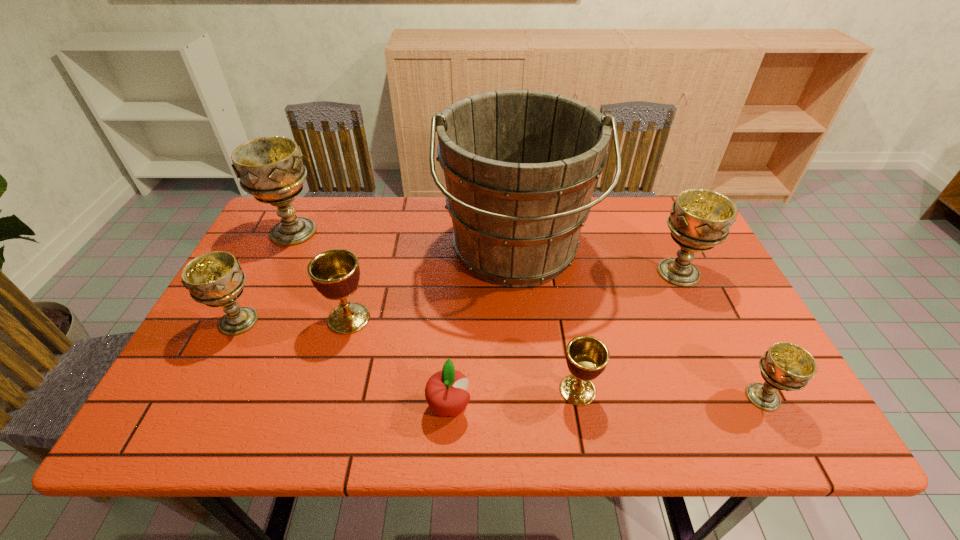
Point out which object is positioned as the nearest to the bigger golden chalice. Please provide its 2D coordinates. Your answer should be formatted as a tuple, i.e. [(x, y)], where the tuple contains the x and y coordinates of a point satisfying the conditions above.

[(215, 279)]

Select which object appears as the second closest to the nearest white chalice. Please provide its 2D coordinates. Your answer should be formatted as a tuple, i.e. [(x, y)], where the tuple contains the x and y coordinates of a point satisfying the conditions above.

[(587, 357)]

Find the location of a particular element. Image resolution: width=960 pixels, height=540 pixels. the sixth closest chalice relative to the tallest object is located at coordinates coord(215,279).

Identify the location of the second closest chalice to the nearest white chalice. (587, 357).

At what (x,y) coordinates should I click in order to perform the action: click on white chalice object that ranks as the closest to the smallest white chalice. Please return your answer as a coordinate pair (x, y). Looking at the image, I should click on (699, 219).

Locate an element on the screen. white chalice that is the second nearest to the farthest chalice is located at coordinates (699, 219).

Identify the location of free space that satisfies the following two spatial constraints: 1. on the back side of the shortest object; 2. on the right side of the nearer golden chalice. (450, 390).

This screenshot has height=540, width=960. I want to click on vacant space that satisfies the following two spatial constraints: 1. on the front side of the apple; 2. on the left side of the second tallest object, so click(208, 407).

Find the location of a particular element. This screenshot has height=540, width=960. vacant region that satisfies the following two spatial constraints: 1. on the back side of the smallest white chalice; 2. on the right side of the red apple is located at coordinates (449, 397).

Where is `blank area in the image that satisfies the following two spatial constraints: 1. on the front side of the biggest white chalice; 2. on the right side of the smallest white chalice`? Image resolution: width=960 pixels, height=540 pixels. blank area in the image that satisfies the following two spatial constraints: 1. on the front side of the biggest white chalice; 2. on the right side of the smallest white chalice is located at coordinates (213, 397).